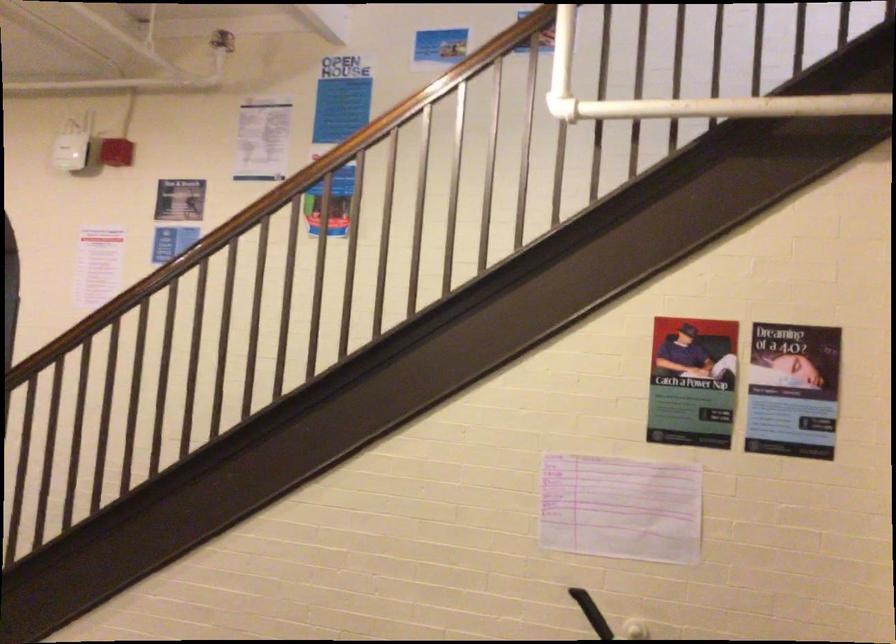
Image resolution: width=896 pixels, height=644 pixels. Find the location of `fire alarm handle`. fire alarm handle is located at coordinates (108, 154).